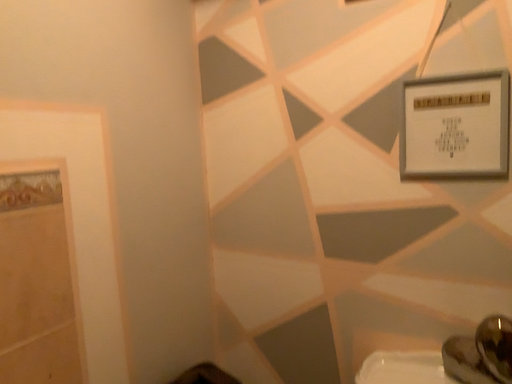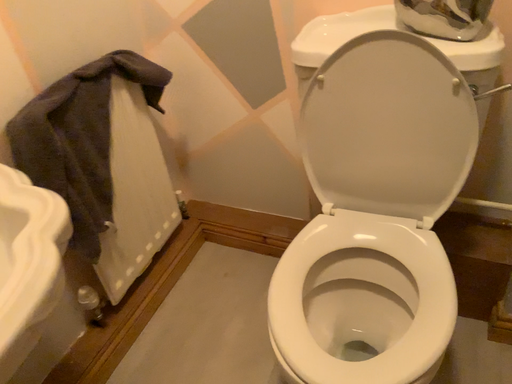
Question: How did the camera likely rotate when shooting the video?

Choices:
 (A) rotated downward
 (B) rotated upward

Answer: (A)